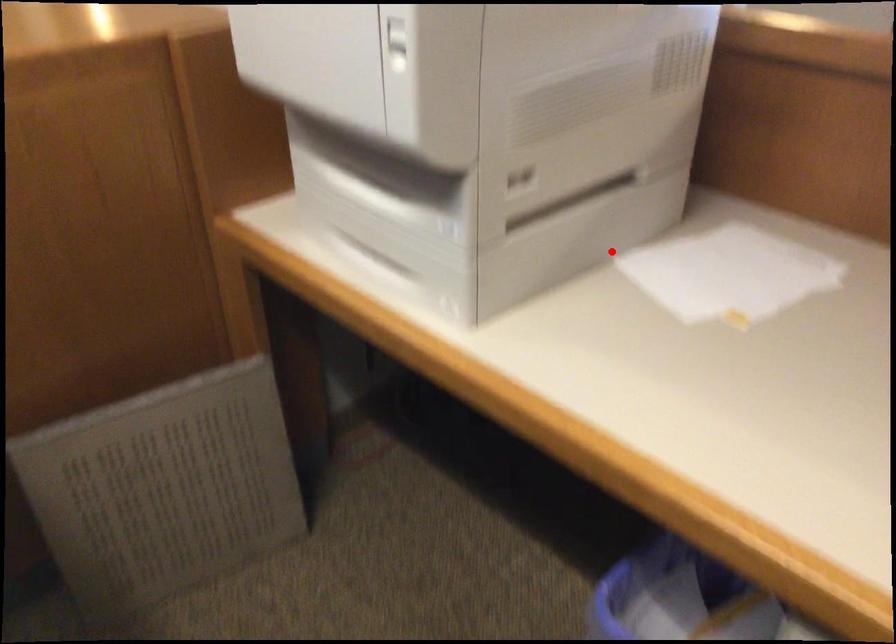
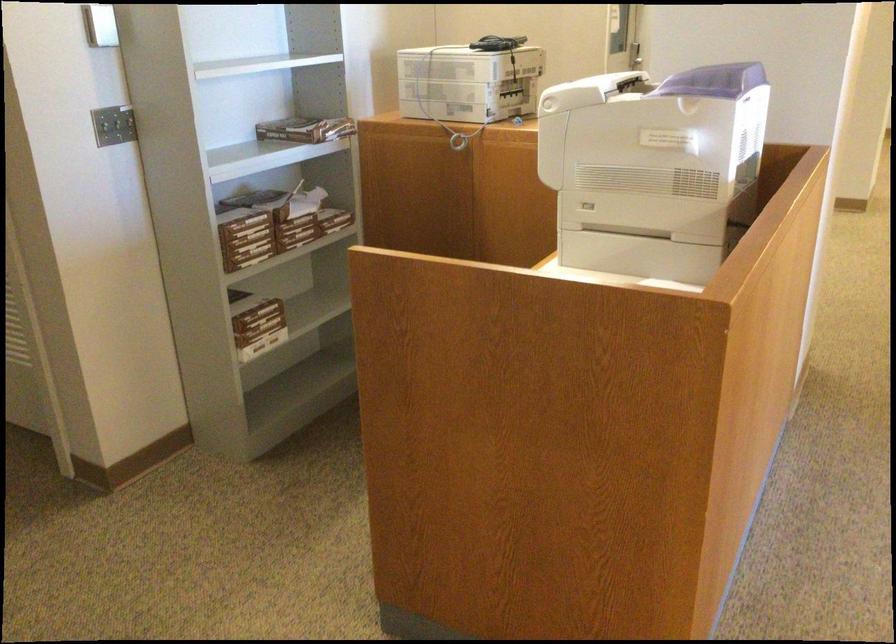
Question: I am providing you with two images of the same scene from different viewpoints. In image1, a red point is highlighted. Considering the same 3D point in image2, which of the following is correct?

Choices:
 (A) It is closer
 (B) It is farther

Answer: (B)